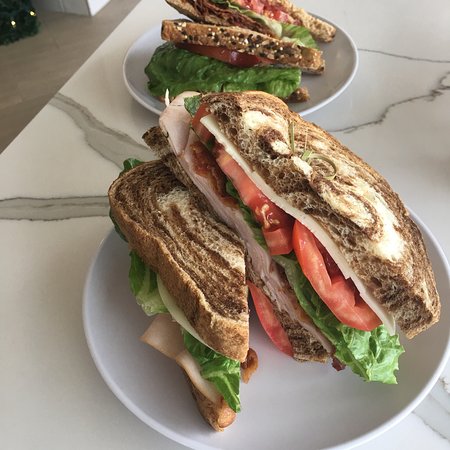
This screenshot has width=450, height=450. In order to click on white plate in this screenshot , I will do `click(332, 64)`, `click(138, 75)`, `click(130, 311)`, `click(311, 373)`, `click(444, 284)`, `click(402, 339)`.